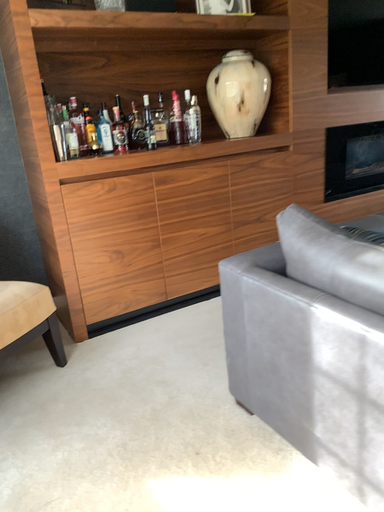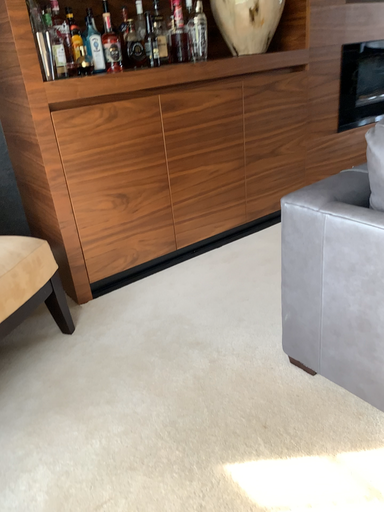
Question: How did the camera likely rotate when shooting the video?

Choices:
 (A) rotated upward
 (B) rotated downward

Answer: (B)